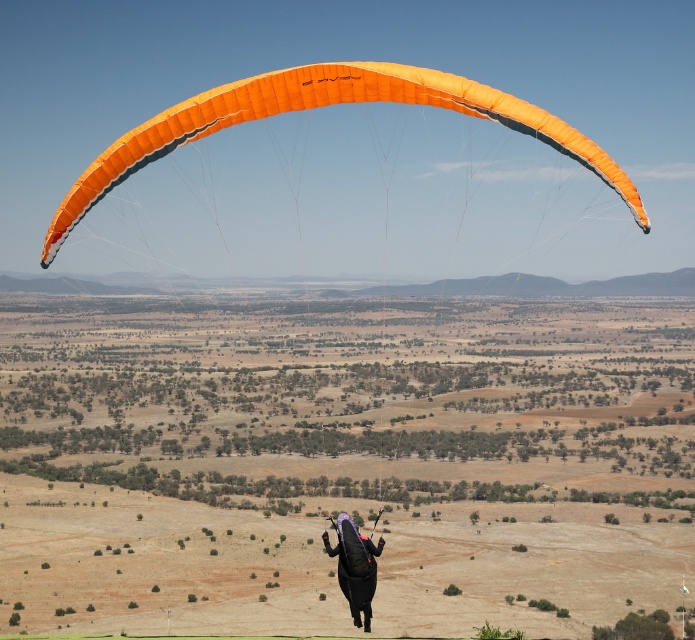
Question: Which point is farther to the camera?

Choices:
 (A) purple matte parachute at center
 (B) orange fabric parachute at upper center

Answer: (A)

Question: Which point appears closest to the camera in this image?

Choices:
 (A) (359, 588)
 (B) (197, 125)

Answer: (B)

Question: Is orange fabric parachute at upper center positioned before purple matte parachute at center?

Choices:
 (A) no
 (B) yes

Answer: (B)

Question: Does orange fabric parachute at upper center have a larger size compared to purple matte parachute at center?

Choices:
 (A) no
 (B) yes

Answer: (B)

Question: Is orange fabric parachute at upper center thinner than purple matte parachute at center?

Choices:
 (A) yes
 (B) no

Answer: (B)